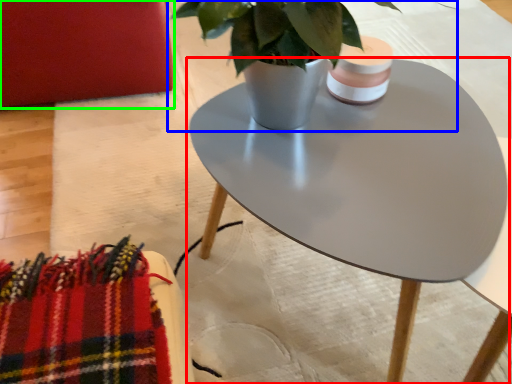
Question: Considering the real-world distances, which object is farthest from coffee table (highlighted by a red box)? houseplant (highlighted by a blue box) or armchair (highlighted by a green box)?

Choices:
 (A) houseplant
 (B) armchair

Answer: (B)